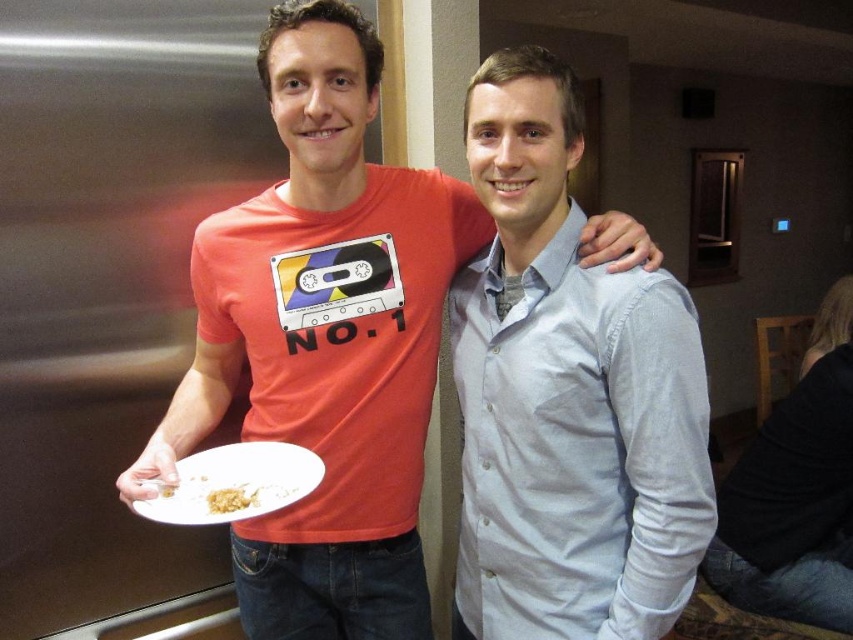
Question: Based on their relative distances, which object is farther from the white matte plate at lower left?

Choices:
 (A) matte orange t-shirt at center
 (B) light blue button-down shirt at center

Answer: (B)

Question: Which object is the closest to the light blue button-down shirt at center?

Choices:
 (A) white matte plate at lower left
 (B) matte orange t-shirt at center

Answer: (B)

Question: Does light blue button-down shirt at center have a lesser width compared to white matte plate at lower left?

Choices:
 (A) yes
 (B) no

Answer: (B)

Question: Is matte orange t-shirt at center positioned before yellow crumbly food at plate left?

Choices:
 (A) no
 (B) yes

Answer: (A)

Question: Which object is the farthest from the light blue button-down shirt at center?

Choices:
 (A) matte orange t-shirt at center
 (B) yellow crumbly food at plate left

Answer: (B)

Question: Does light blue button-down shirt at center have a larger size compared to white matte plate at lower left?

Choices:
 (A) yes
 (B) no

Answer: (A)